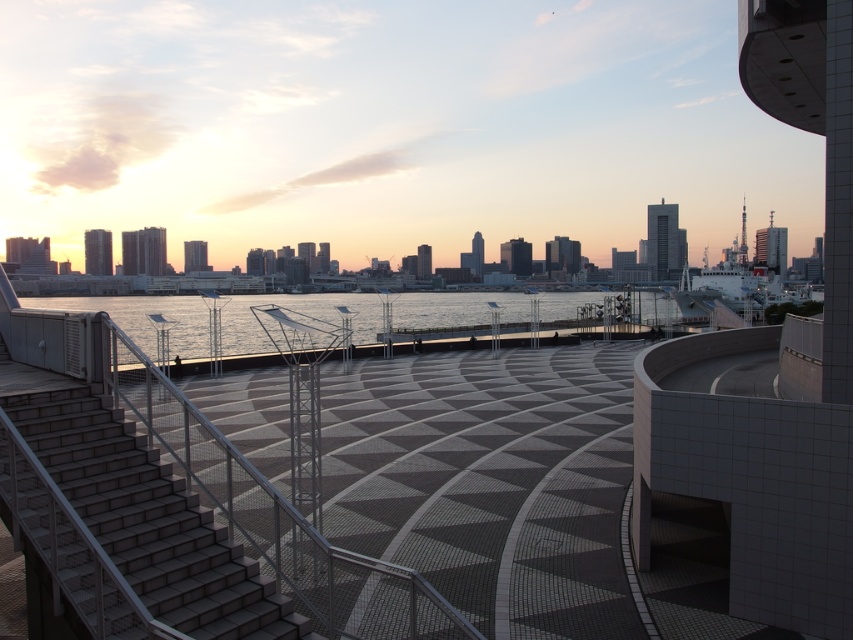
Question: Can you confirm if gray concrete stairs at lower left is positioned to the right of clear water at center?

Choices:
 (A) yes
 (B) no

Answer: (A)

Question: Is gray concrete stairs at lower left positioned behind clear water at center?

Choices:
 (A) no
 (B) yes

Answer: (A)

Question: Is gray concrete stairs at lower left to the right of clear water at center from the viewer's perspective?

Choices:
 (A) no
 (B) yes

Answer: (B)

Question: Which of the following is the closest to the observer?

Choices:
 (A) (404, 314)
 (B) (146, 515)

Answer: (B)